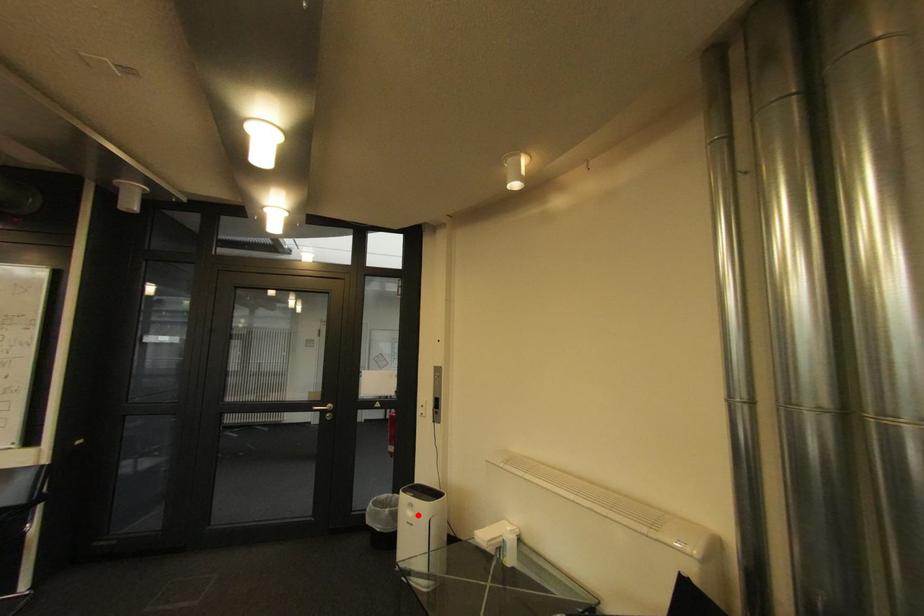
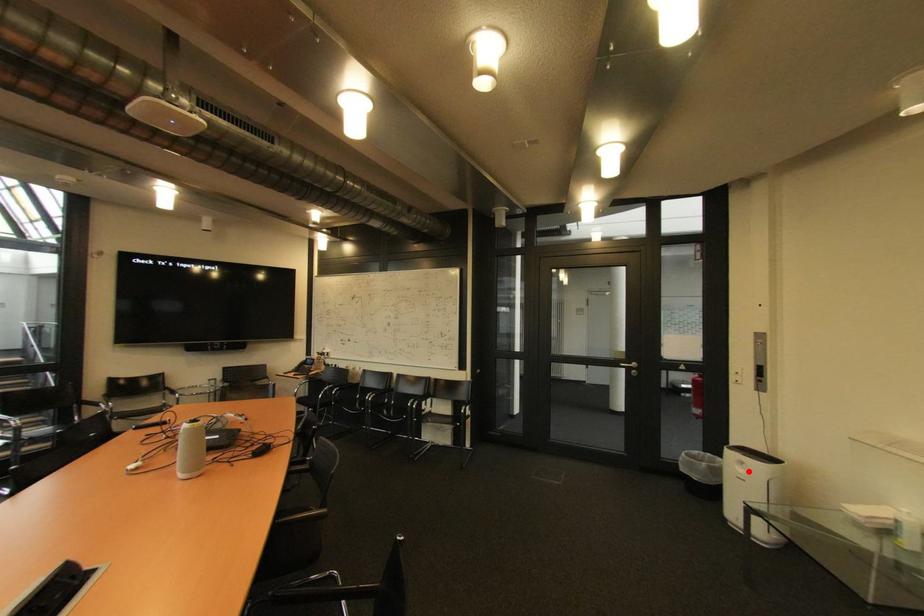
I am providing you with two images of the same scene from different viewpoints. A red point is marked on the first image and another point is marked on the second image. Is the marked point in image1 the same physical position as the marked point in image2?

Yes